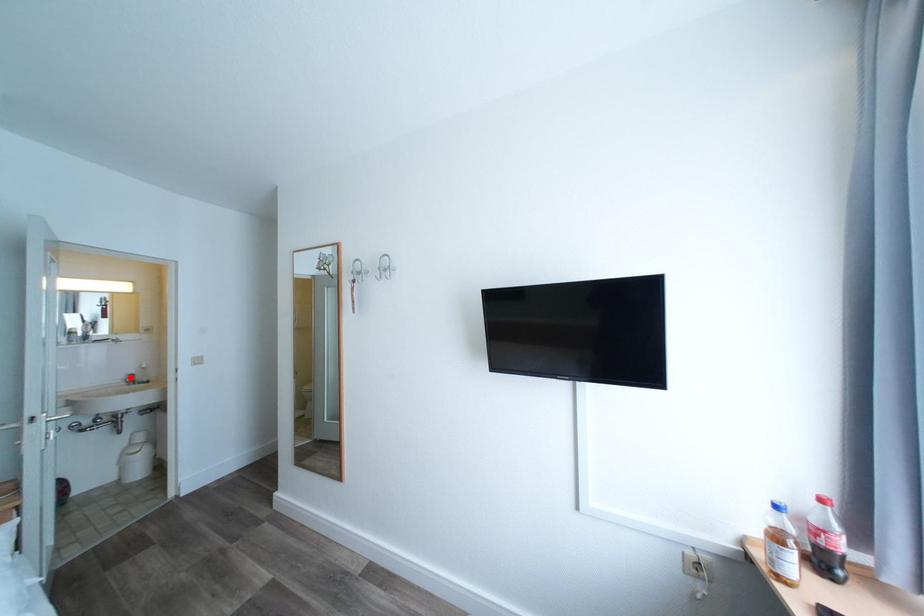
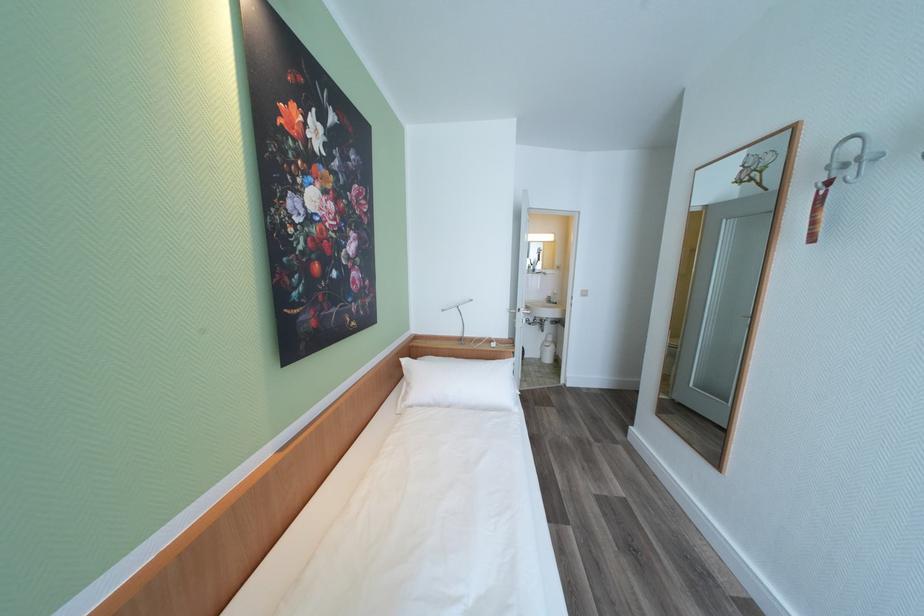
Find the pixel in the second image that matches the highlighted location in the first image.

(553, 299)